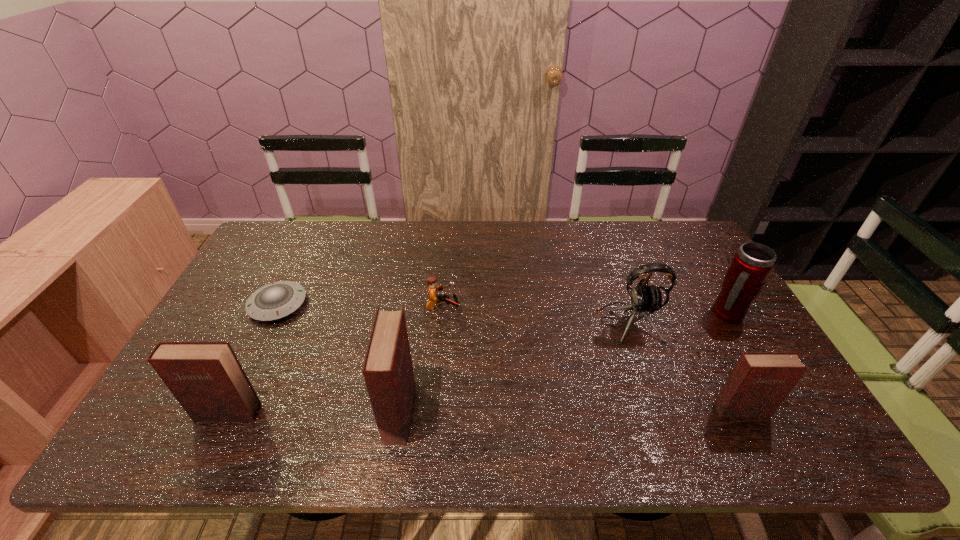
Image resolution: width=960 pixels, height=540 pixels. I want to click on vacant space at the far edge, so click(496, 220).

Image resolution: width=960 pixels, height=540 pixels. In order to click on free space at the near edge of the desktop in this screenshot , I will do `click(644, 412)`.

In the image, there is a desktop. Where is `vacant space at the left edge`? vacant space at the left edge is located at coordinates (211, 333).

Locate an element on the screen. This screenshot has height=540, width=960. blank space at the right edge of the desktop is located at coordinates (751, 336).

What are the coordinates of `free space at the far left corner of the desktop` in the screenshot? It's located at (274, 246).

You are a GUI agent. You are given a task and a screenshot of the screen. Output one action in this format:
    pyautogui.click(x=<x>, y=<y>)
    Task: Click on the vacant space at the far right corner of the desktop
    The height and width of the screenshot is (540, 960).
    Given the screenshot: What is the action you would take?
    pyautogui.click(x=672, y=239)

Image resolution: width=960 pixels, height=540 pixels. Find the location of `vacant space that is in between the second shortest object and the rightmost diary`. vacant space that is in between the second shortest object and the rightmost diary is located at coordinates (592, 359).

Identify the location of free space between the third shortest object and the third object from left to right. Image resolution: width=960 pixels, height=540 pixels. (570, 411).

Where is `free space between the Lego and the earphone`? free space between the Lego and the earphone is located at coordinates (536, 315).

Locate an element on the screen. The width and height of the screenshot is (960, 540). blank region between the rightmost diary and the thermos bottle is located at coordinates (734, 362).